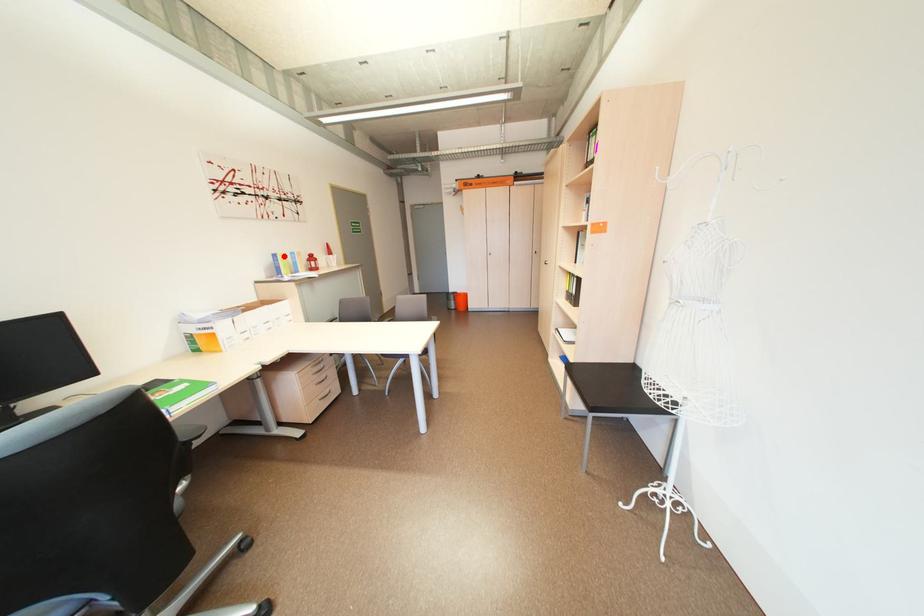
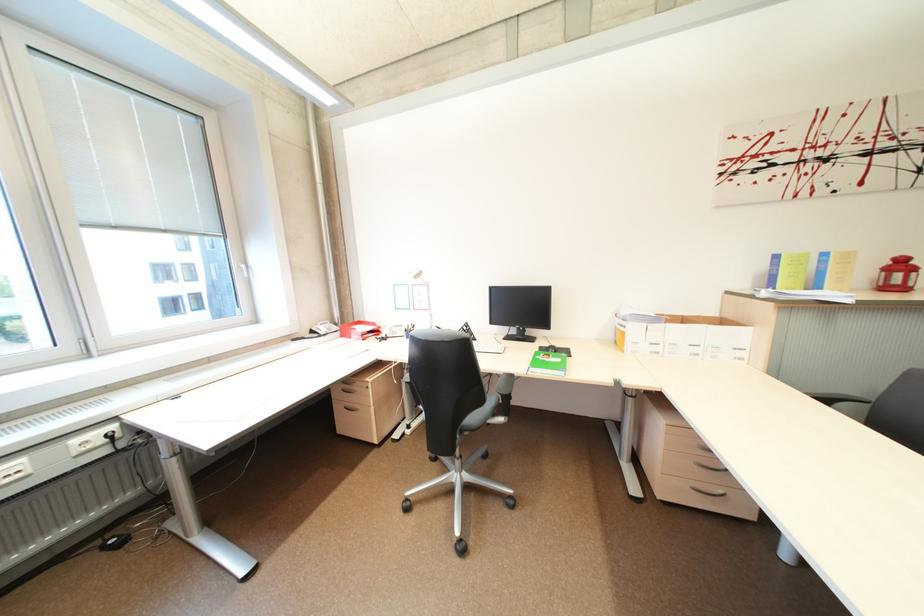
Question: I am providing you with two images of the same scene from different viewpoints. In image1, a red point is highlighted. Considering the same 3D point in image2, which of the following is correct?

Choices:
 (A) It is closer
 (B) It is farther

Answer: (B)